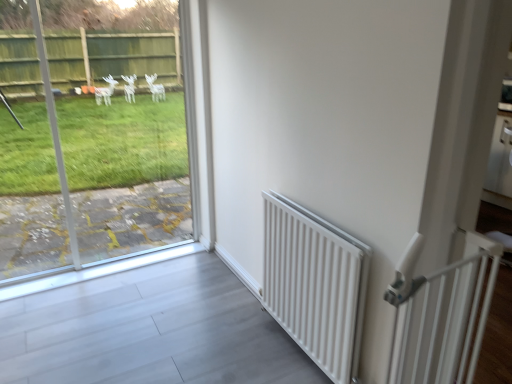
Question: Is white plastic gate at right positioned far away from white matte radiator at right?

Choices:
 (A) no
 (B) yes

Answer: (A)

Question: Is white plastic gate at right in contact with white matte radiator at right?

Choices:
 (A) no
 (B) yes

Answer: (A)

Question: Is white plastic gate at right positioned before white matte radiator at right?

Choices:
 (A) no
 (B) yes

Answer: (B)

Question: Is white plastic gate at right positioned behind white matte radiator at right?

Choices:
 (A) yes
 (B) no

Answer: (B)

Question: Would you say white plastic gate at right is outside white matte radiator at right?

Choices:
 (A) yes
 (B) no

Answer: (A)

Question: Can you confirm if white plastic gate at right is wider than white matte radiator at right?

Choices:
 (A) yes
 (B) no

Answer: (B)

Question: From a real-world perspective, is transparent glass window at left positioned under white matte radiator at right based on gravity?

Choices:
 (A) yes
 (B) no

Answer: (B)

Question: Does transparent glass window at left appear on the right side of white matte radiator at right?

Choices:
 (A) yes
 (B) no

Answer: (B)

Question: Can you confirm if transparent glass window at left is shorter than white matte radiator at right?

Choices:
 (A) yes
 (B) no

Answer: (B)

Question: Considering the relative sizes of transparent glass window at left and white matte radiator at right in the image provided, is transparent glass window at left bigger than white matte radiator at right?

Choices:
 (A) no
 (B) yes

Answer: (B)

Question: Is transparent glass window at left at the left side of white matte radiator at right?

Choices:
 (A) no
 (B) yes

Answer: (B)

Question: Is transparent glass window at left with white matte radiator at right?

Choices:
 (A) no
 (B) yes

Answer: (A)

Question: Is transparent glass window at left located within white matte radiator at right?

Choices:
 (A) yes
 (B) no

Answer: (B)